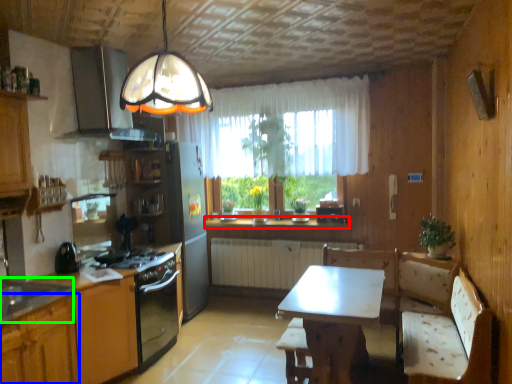
Question: Which object is positioned farthest from countertop (highlighted by a red box)? Select from cabinetry (highlighted by a blue box) and sink (highlighted by a green box).

Choices:
 (A) cabinetry
 (B) sink

Answer: (A)